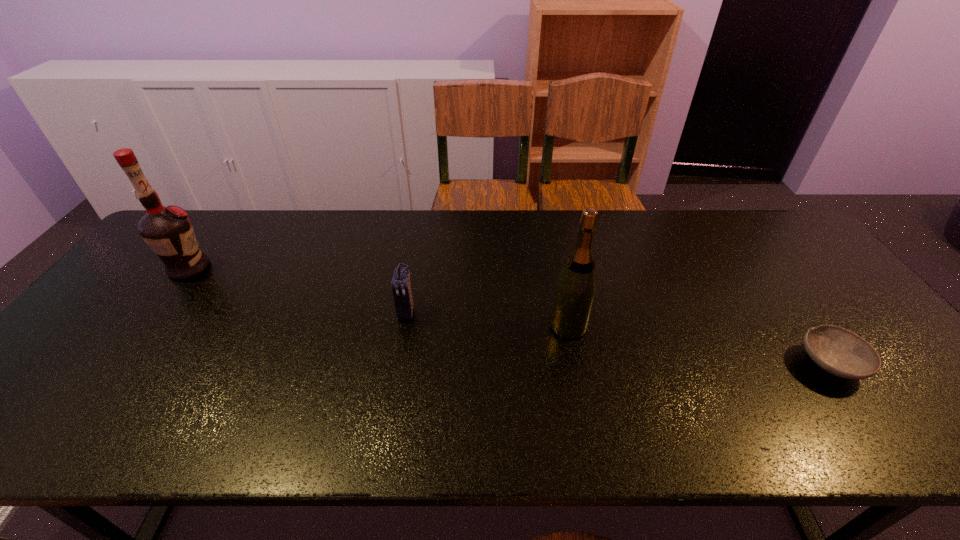
Where is `empty location between the clutch bag and the rightmost object`? Image resolution: width=960 pixels, height=540 pixels. empty location between the clutch bag and the rightmost object is located at coordinates (618, 338).

What are the coordinates of `empty location between the wine bottle and the bowl` in the screenshot? It's located at (700, 345).

In order to click on blank region between the leftmost object and the third tallest object in this screenshot , I will do `click(298, 290)`.

The height and width of the screenshot is (540, 960). What are the coordinates of `vacant region between the rightmost object and the third tallest object` in the screenshot? It's located at (618, 338).

Identify the location of vacant space that's between the rightmost object and the leftmost object. (510, 316).

Find the location of `vacant area between the shortest object and the third object from right to left`. vacant area between the shortest object and the third object from right to left is located at coordinates (618, 338).

The width and height of the screenshot is (960, 540). Identify the location of free space between the second object from right to left and the shortest object. (700, 345).

Find the location of `vacant area that lies between the wine bottle and the second shortest object`. vacant area that lies between the wine bottle and the second shortest object is located at coordinates (488, 319).

This screenshot has height=540, width=960. In order to click on free space between the wine bottle and the rightmost object in this screenshot , I will do `click(700, 345)`.

Where is `free area in between the liquor and the clutch bag`? The image size is (960, 540). free area in between the liquor and the clutch bag is located at coordinates (298, 290).